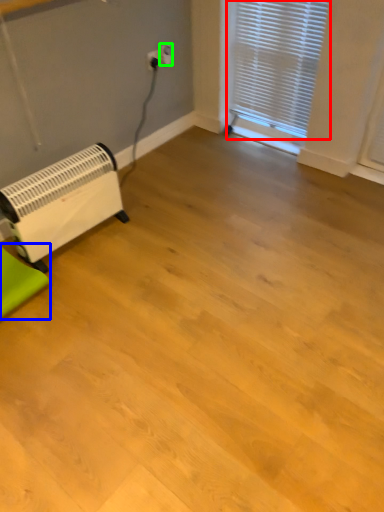
Question: Considering the real-world distances, which object is closest to window blind (highlighted by a red box)? furniture (highlighted by a blue box) or electric outlet (highlighted by a green box).

Choices:
 (A) furniture
 (B) electric outlet

Answer: (B)